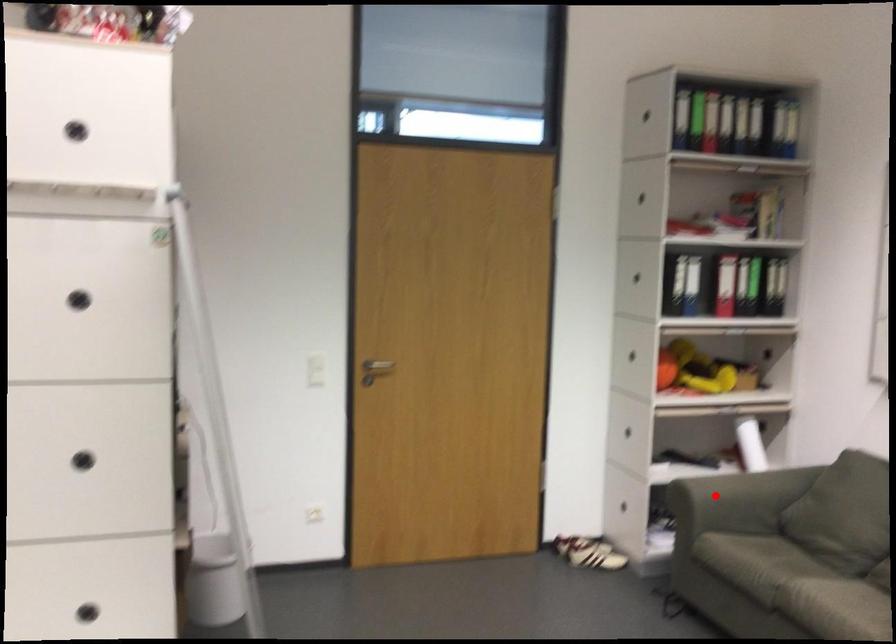
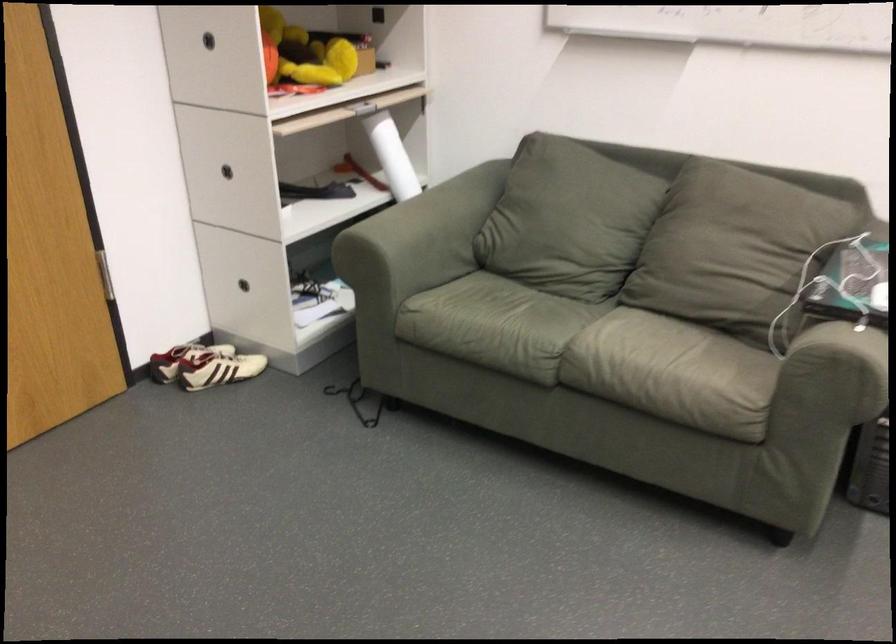
Where in the second image is the point corresponding to the highlighted location from the first image?

(416, 242)